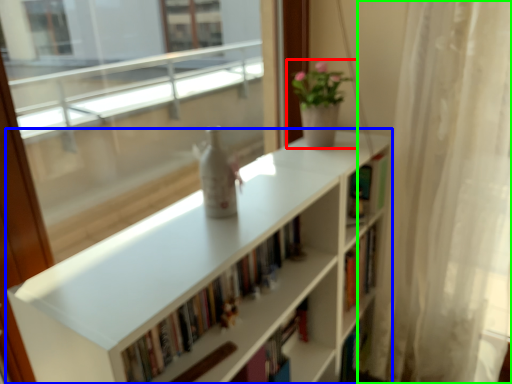
Question: Based on their relative distances, which object is farther from houseplant (highlighted by a red box)? Choose from bookcase (highlighted by a blue box) and curtain (highlighted by a green box).

Choices:
 (A) bookcase
 (B) curtain

Answer: (B)